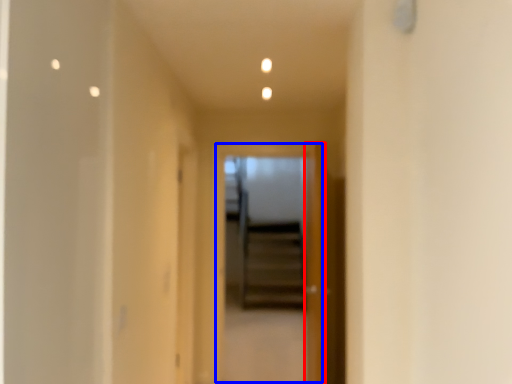
Question: Which point is closer to the camera, door (highlighted by a red box) or screen door (highlighted by a blue box)?

Choices:
 (A) door
 (B) screen door

Answer: (A)